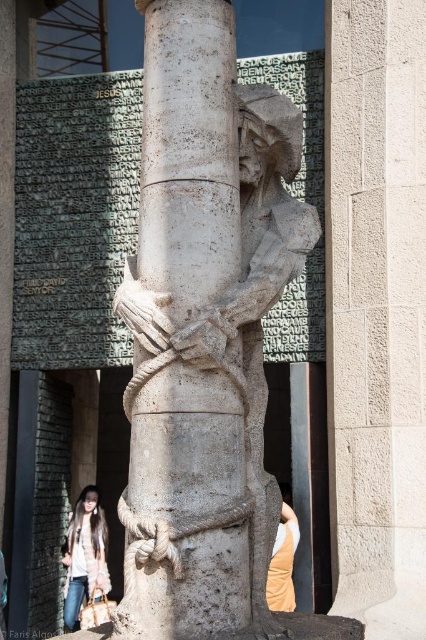
You are an artist preparing to create a detailed sketch of the sculpture. You notice two materials in the scene, the light brown fur coat at lower left and the beige fabric at lower right. Which material would require more detailed shading due to its texture?

The light brown fur coat at lower left requires more detailed shading because it is thinner than the beige fabric at lower right, which means its texture is more intricate and requires careful rendering.